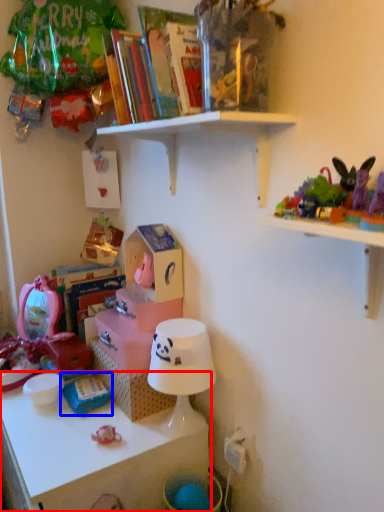
Question: Which point is closer to the camera, shelf (highlighted by a red box) or toy (highlighted by a blue box)?

Choices:
 (A) shelf
 (B) toy

Answer: (A)